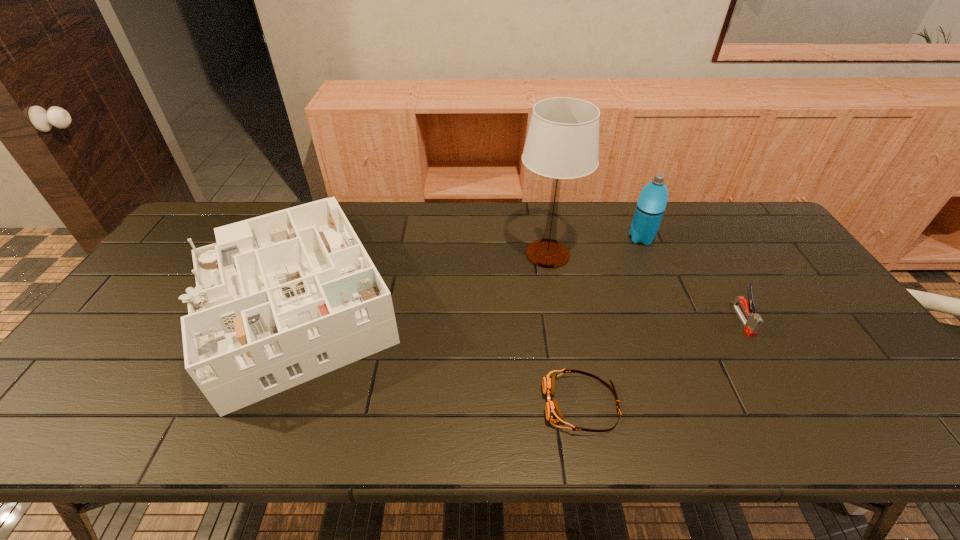
Where is `object that is positioned at the left edge`? The image size is (960, 540). object that is positioned at the left edge is located at coordinates (280, 299).

The width and height of the screenshot is (960, 540). I want to click on object positioned at the far left corner, so click(x=280, y=299).

Where is `object situated at the near left corner`? object situated at the near left corner is located at coordinates (x=280, y=299).

Locate an element on the screen. vacant space at the far edge of the desktop is located at coordinates (497, 204).

Find the location of `free space at the near edge of the desktop`. free space at the near edge of the desktop is located at coordinates pyautogui.click(x=545, y=439).

You are a GUI agent. You are given a task and a screenshot of the screen. Output one action in this format:
    pyautogui.click(x=<x>, y=<y>)
    Task: Click on the vacant area at the left edge
    This screenshot has height=540, width=960.
    Given the screenshot: What is the action you would take?
    pyautogui.click(x=185, y=259)

What are the coordinates of `vacant space at the right edge of the desktop` in the screenshot? It's located at (861, 381).

Where is `free spot between the tallest object and the goggles`? free spot between the tallest object and the goggles is located at coordinates click(x=564, y=329).

Image resolution: width=960 pixels, height=540 pixels. I want to click on vacant space in between the second tallest object and the tallest object, so (594, 246).

The height and width of the screenshot is (540, 960). Identify the location of free space between the goggles and the second tallest object. (612, 321).